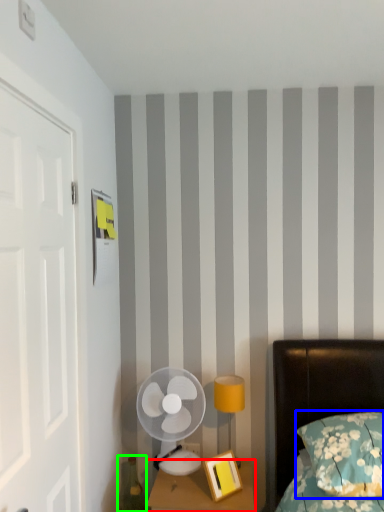
Question: Based on their relative distances, which object is nearer to nightstand (highlighted by a red box)? Choose from pillow (highlighted by a blue box) and teal (highlighted by a green box).

Choices:
 (A) pillow
 (B) teal

Answer: (B)